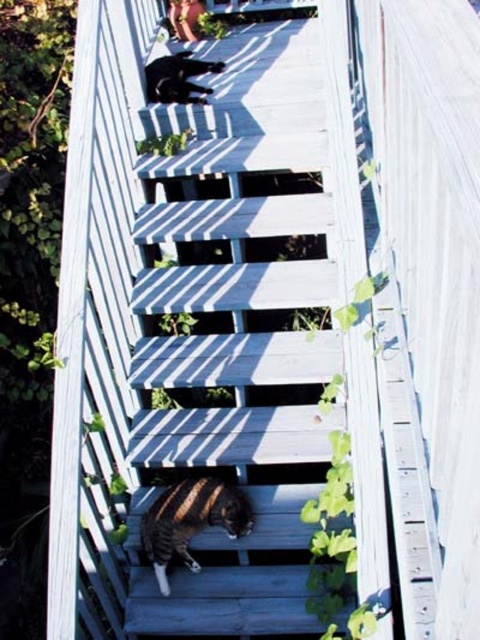
Is smooth wooden stairs at upper center closer to the viewer compared to shiny black cat at upper center?

Yes, smooth wooden stairs at upper center is closer to the viewer.

Does smooth wooden stairs at upper center have a greater width compared to shiny black cat at upper center?

Correct, the width of smooth wooden stairs at upper center exceeds that of shiny black cat at upper center.

Which is in front, point (300, 492) or point (159, 61)?

Point (300, 492)

I want to click on smooth wooden stairs at upper center, so click(x=236, y=332).

Can you confirm if smooth wooden stairs at upper center is wider than tabby fur cat at center?

Yes.

Which of these two, smooth wooden stairs at upper center or tabby fur cat at center, stands shorter?

tabby fur cat at center

Image resolution: width=480 pixels, height=640 pixels. What do you see at coordinates (236, 332) in the screenshot? I see `smooth wooden stairs at upper center` at bounding box center [236, 332].

This screenshot has height=640, width=480. In order to click on smooth wooden stairs at upper center in this screenshot , I will do `click(236, 332)`.

Looking at this image, which of these two, tabby fur cat at center or shiny black cat at upper center, stands taller?

tabby fur cat at center is taller.

Measure the distance from tabby fur cat at center to shiny black cat at upper center.

The distance of tabby fur cat at center from shiny black cat at upper center is 6.17 feet.

Is point (218, 481) positioned before point (155, 67)?

That is True.

Where is `tabby fur cat at center`? tabby fur cat at center is located at coordinates (191, 520).